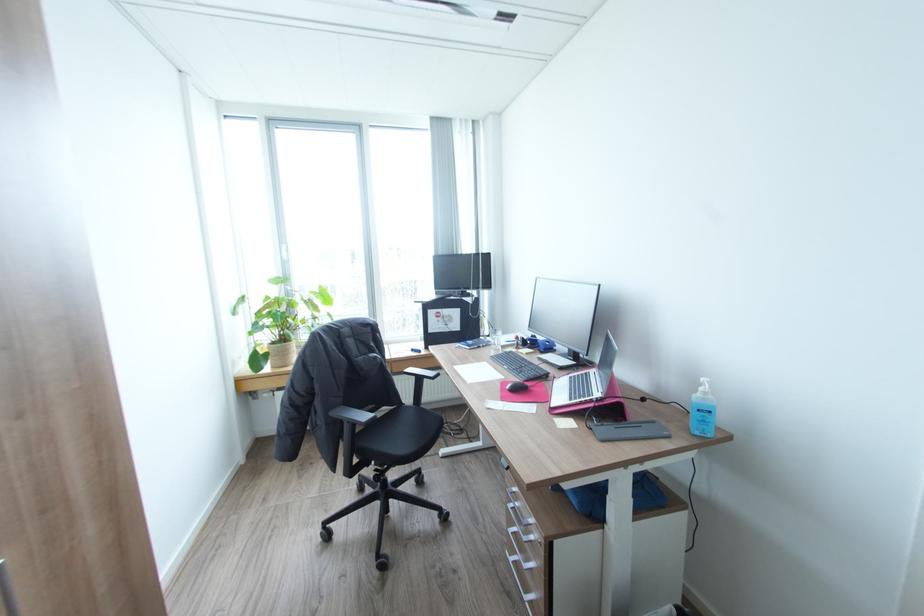
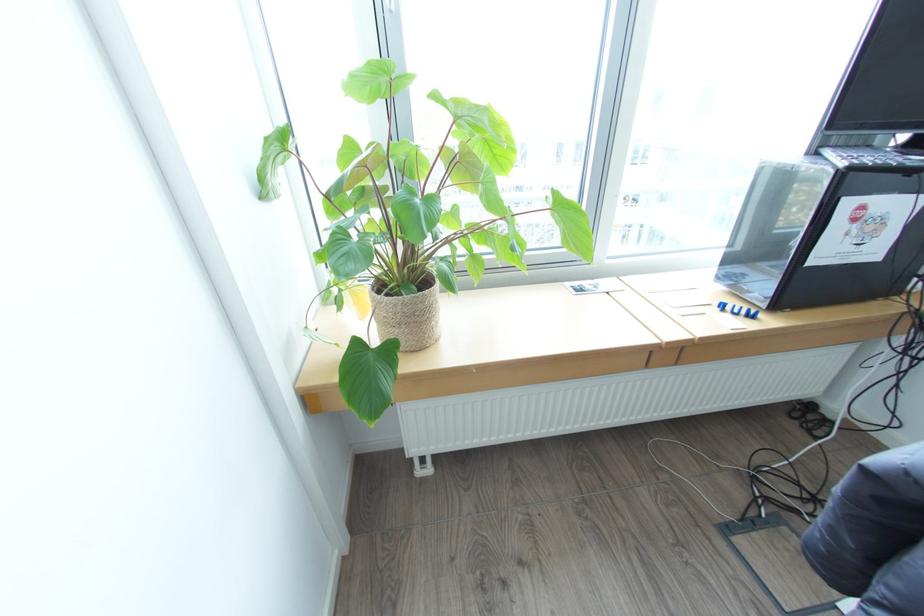
In a continuous first-person perspective shot, in which direction is the camera moving?

The movement direction of the cameraman is left, forward.